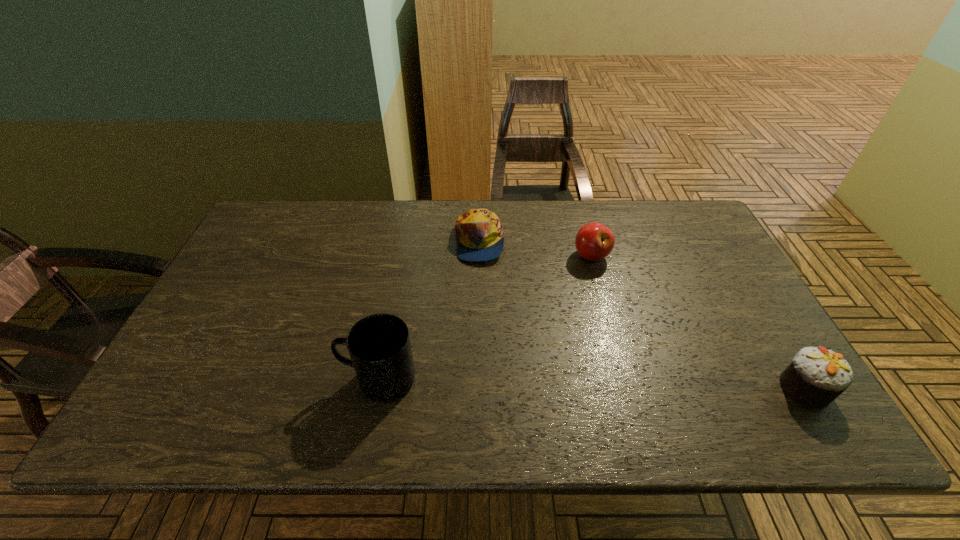
Where is `vacant space on the desktop that is between the tallest object and the cupcake and is positioned on the bill of the cap`? This screenshot has height=540, width=960. vacant space on the desktop that is between the tallest object and the cupcake and is positioned on the bill of the cap is located at coordinates (595, 384).

This screenshot has width=960, height=540. In order to click on vacant space on the desktop that is between the mug and the cupcake and is positioned on the stem of the second object from right to left in this screenshot , I will do `click(566, 383)`.